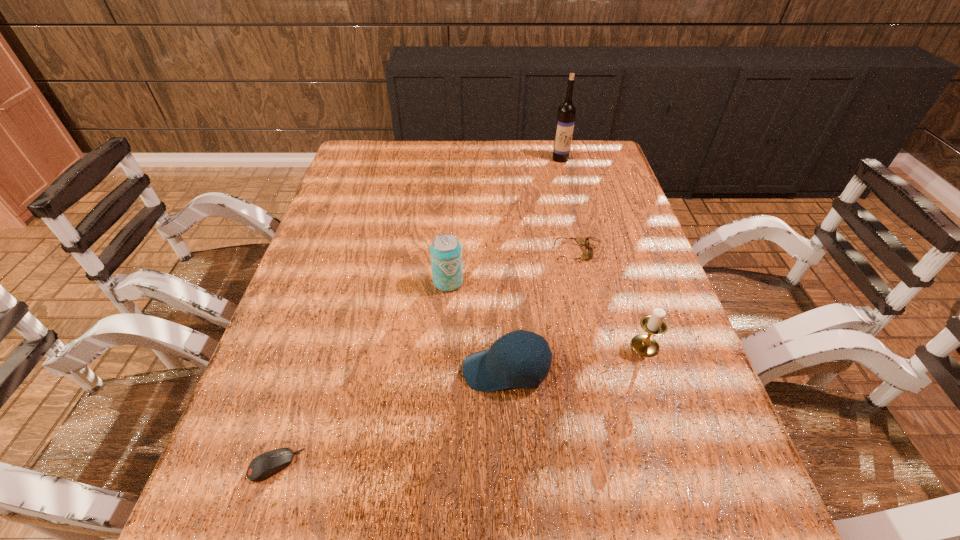
Where is `free region at the far left corner of the desktop`? The width and height of the screenshot is (960, 540). free region at the far left corner of the desktop is located at coordinates point(359,156).

In the image, there is a desktop. Where is `vacant space at the far right corner`? The width and height of the screenshot is (960, 540). vacant space at the far right corner is located at coordinates (600, 171).

This screenshot has width=960, height=540. I want to click on vacant point located between the leftmost object and the fourth tallest object, so click(391, 418).

Locate an element on the screen. The image size is (960, 540). vacant region between the second shortest object and the third object from left to right is located at coordinates (541, 312).

Identify the location of free space between the rightmost object and the farthest object. The width and height of the screenshot is (960, 540). (603, 252).

Locate an element on the screen. free space between the fourth nearest object and the computer mouse is located at coordinates (362, 374).

I want to click on vacant point located between the second object from left to right and the tallest object, so click(x=504, y=220).

Find the location of a particular element. The width and height of the screenshot is (960, 540). vacant area between the fifth object from right to left and the fourth tallest object is located at coordinates (477, 327).

This screenshot has height=540, width=960. Identify the location of vacant space in between the farthest object and the fourth tallest object. (533, 265).

I want to click on vacant area between the tallest object and the fourth nearest object, so click(504, 220).